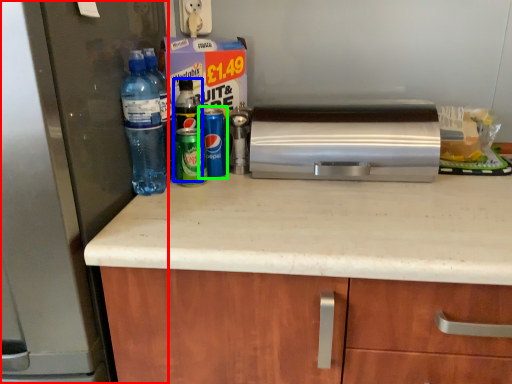
Question: Estimate the real-world distances between objects in this image. Which object is closer to refrigerator (highlighted by a red box), bottle (highlighted by a blue box) or bottle (highlighted by a green box)?

Choices:
 (A) bottle
 (B) bottle

Answer: (B)